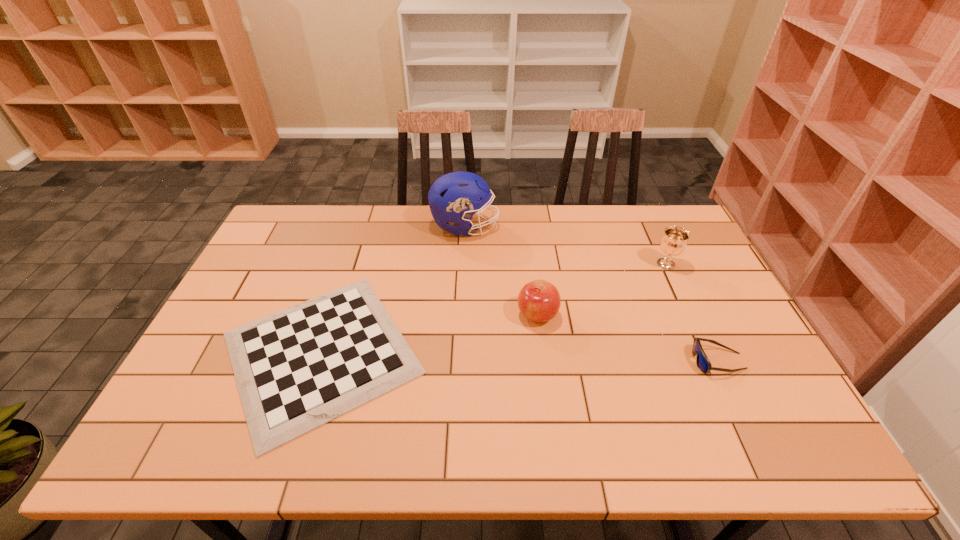
The image size is (960, 540). Find the location of `vacant space located 0.150m on the front-facing side of the fourth tallest object`. vacant space located 0.150m on the front-facing side of the fourth tallest object is located at coordinates (634, 361).

What are the coordinates of `vacant region located 0.300m on the front-facing side of the fourth tallest object` in the screenshot? It's located at (576, 361).

The width and height of the screenshot is (960, 540). Find the location of `vacant point located 0.130m on the front-facing side of the fourth tallest object`. vacant point located 0.130m on the front-facing side of the fourth tallest object is located at coordinates [x=641, y=361].

This screenshot has width=960, height=540. Find the location of `free spot located 0.270m on the right of the chessboard`. free spot located 0.270m on the right of the chessboard is located at coordinates (532, 353).

Where is `object that is at the far edge`? This screenshot has height=540, width=960. object that is at the far edge is located at coordinates (455, 197).

The width and height of the screenshot is (960, 540). I want to click on object at the near edge, so click(297, 369).

Identify the location of object that is at the left edge. Image resolution: width=960 pixels, height=540 pixels. (297, 369).

Image resolution: width=960 pixels, height=540 pixels. What are the coordinates of `chalice located in the right edge section of the desktop` in the screenshot? It's located at (674, 241).

Locate an element on the screen. sunglasses present at the right edge is located at coordinates (703, 363).

The width and height of the screenshot is (960, 540). In order to click on object positioned at the near left corner in this screenshot , I will do `click(297, 369)`.